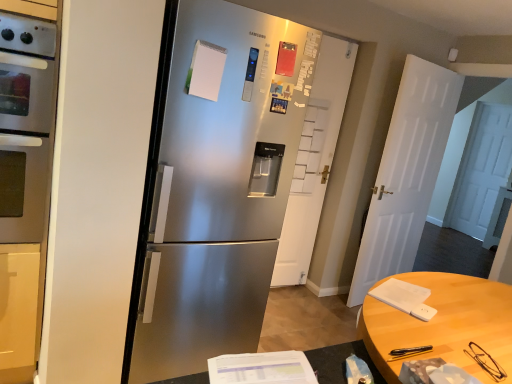
Identify the location of empty space that is ontop of white matte door at center, the 1th door positioned from the left (from a real-world perspective). This screenshot has width=512, height=384. (343, 40).